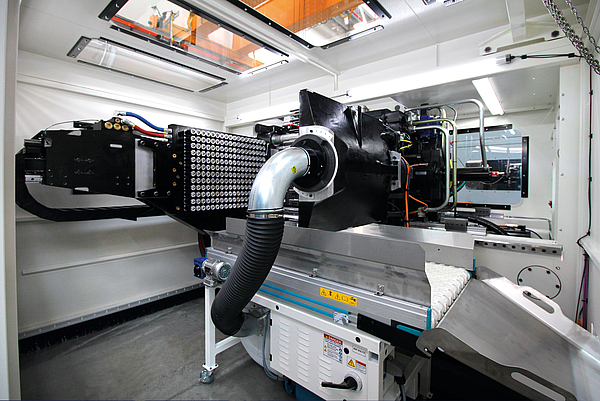
Find the location of a particular element. This screenshot has height=401, width=600. ceiling lights is located at coordinates (491, 103).